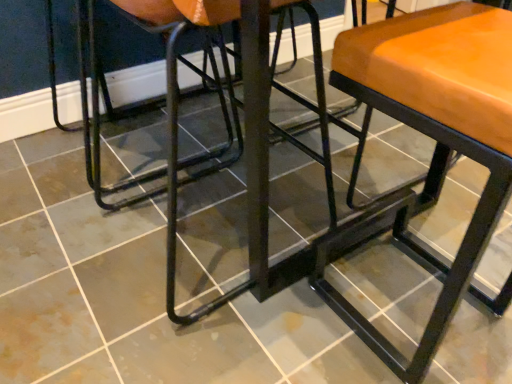
This screenshot has width=512, height=384. What are the coordinates of `vacant area to the left of black metal swivel chair at left` in the screenshot? It's located at (37, 160).